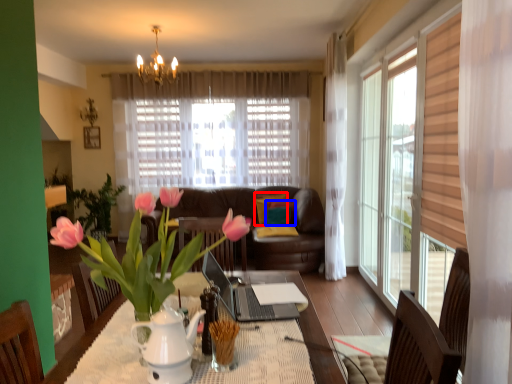
Question: Among these objects, which one is farthest to the camera, pillow (highlighted by a red box) or pillow (highlighted by a blue box)?

Choices:
 (A) pillow
 (B) pillow

Answer: (A)